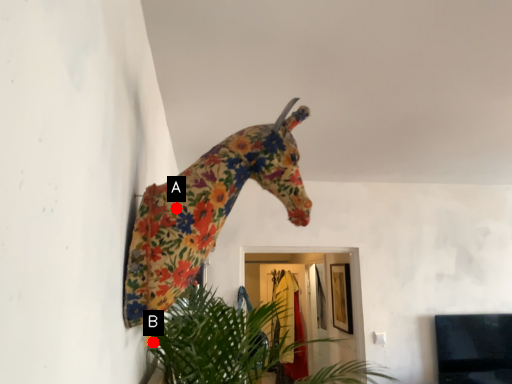
Question: Two points are circled on the image, labeled by A and B beside each circle. Which point is closer to the camera?

Choices:
 (A) A is closer
 (B) B is closer

Answer: (A)